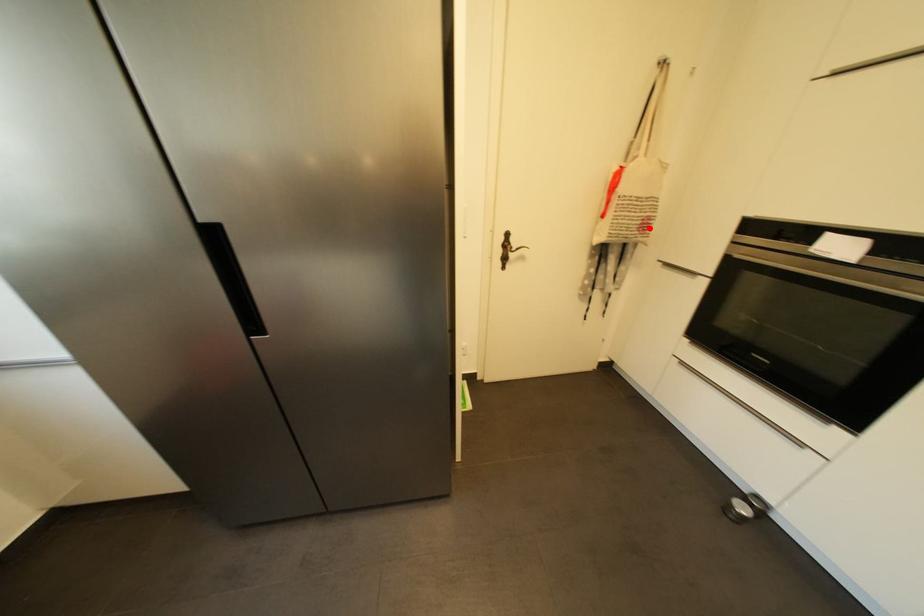
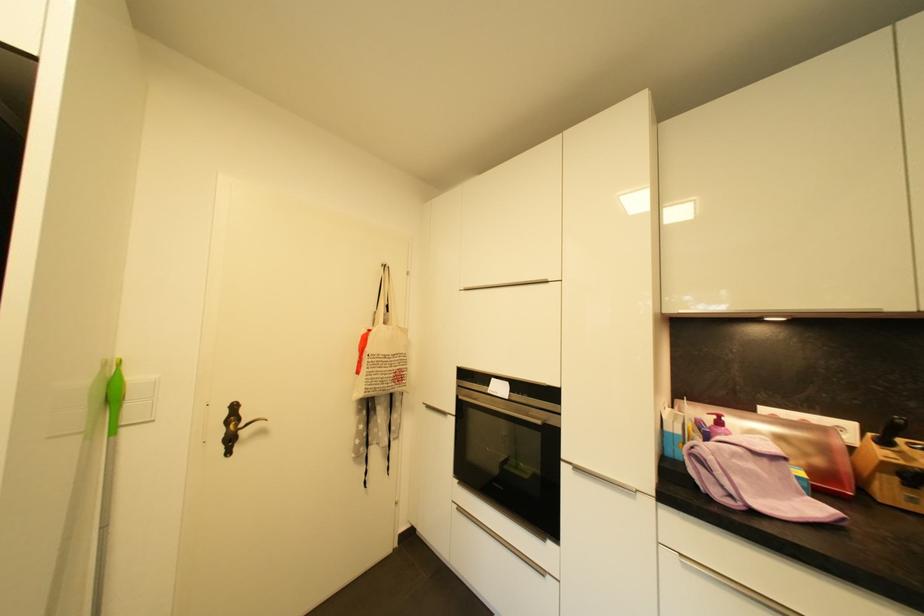
Question: I am providing you with two images of the same scene from different viewpoints. Given a red point in image1, look at the same physical point in image2. Is it:

Choices:
 (A) Closer to the viewpoint
 (B) Farther from the viewpoint

Answer: (B)